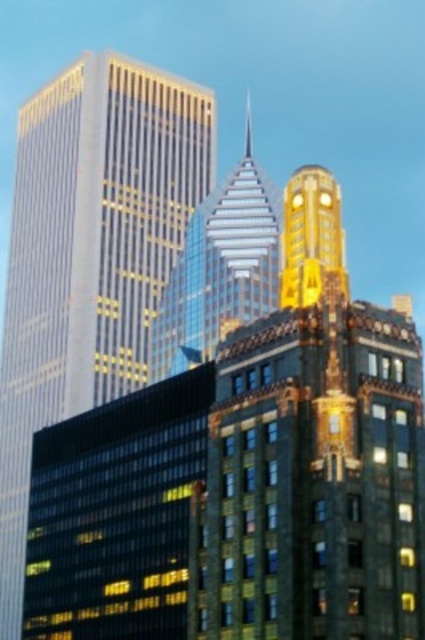
You are a drone operator tasked with flying a drone between the gold glass skyscraper at left and the shiny glass skyscraper at center. The drone has a wingspan of 1.5 meters. Can the drone safely navigate the space between them?

The distance between the gold glass skyscraper at left and the shiny glass skyscraper at center is 17.76 meters. Since the drone has a wingspan of 1.5 meters, there is ample space for it to safely navigate the gap between them.

You are standing in front of the cluster of modern skyscrapers. There are two points marked on the buildings. The first point is at coordinates point (240, 598) and the second point is at point (246, 292). Which of these points appears closer to you?

Point (240, 598) is closer to the viewer than point (246, 292).

You are a drone operator tasked with flying a drone between the gold textured building at center and the gold glass skyscraper at left. The drone has a maximum flight distance of 40 meters. Can the drone safely fly between these two buildings without exceeding its range?

The gold textured building at center and gold glass skyscraper at left are 39.44 meters apart from each other. Since the drone has a maximum flight distance of 40 meters, it can safely fly between them without exceeding its range.